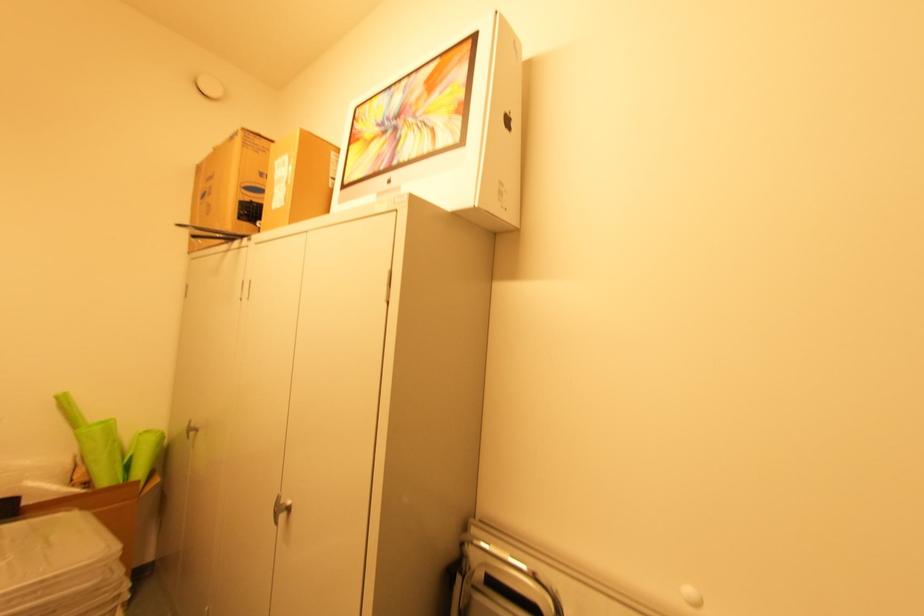
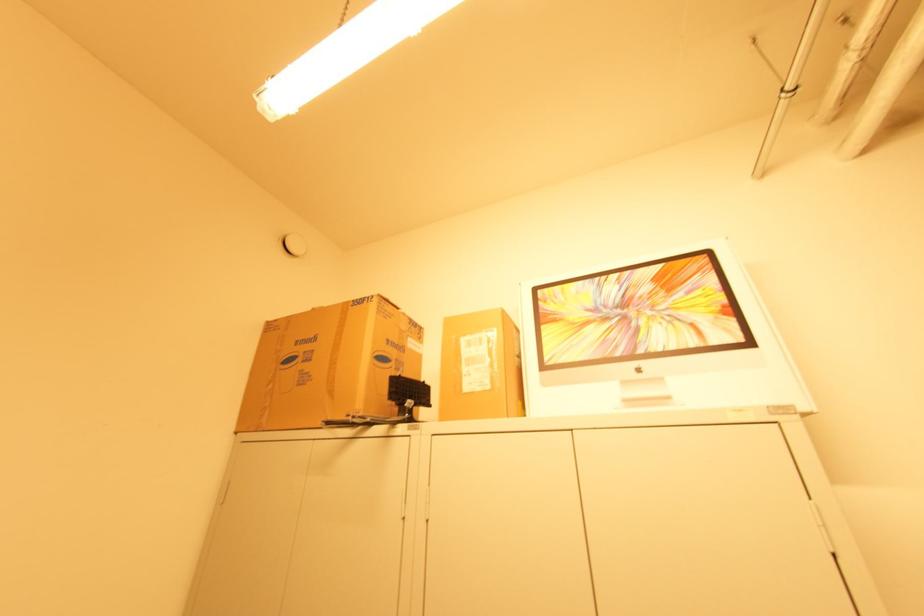
Question: In a continuous first-person perspective shot, in which direction is the camera moving?

Choices:
 (A) Left
 (B) Right
 (C) Forward
 (D) Backward

Answer: (A)